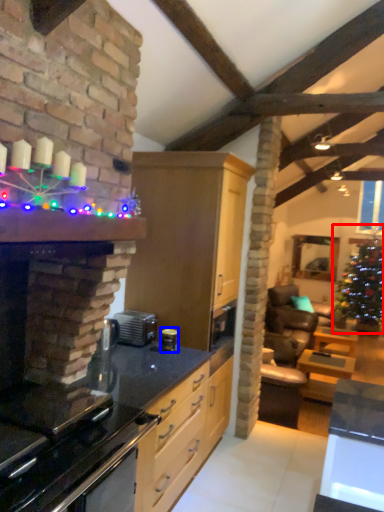
Question: Among these objects, which one is nearest to the camera, christmas tree (highlighted by a red box) or appliance (highlighted by a blue box)?

Choices:
 (A) christmas tree
 (B) appliance

Answer: (B)